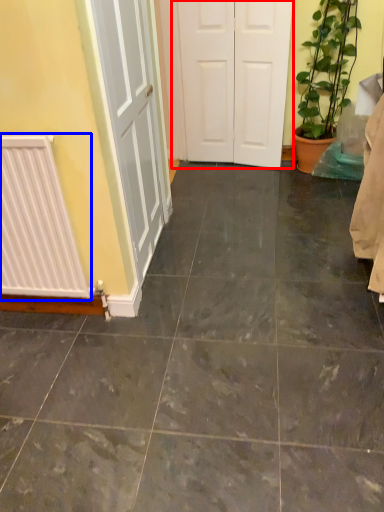
Question: Which object appears closest to the camera in this image, door (highlighted by a red box) or radiator (highlighted by a blue box)?

Choices:
 (A) door
 (B) radiator

Answer: (B)